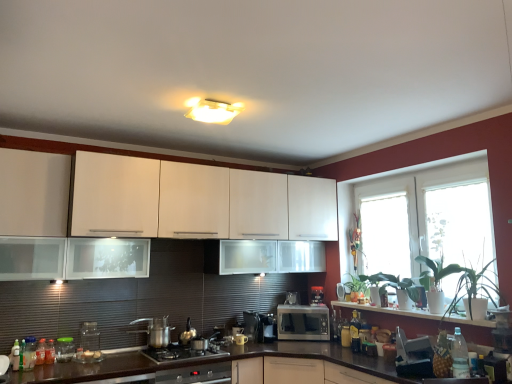
Question: Is golden glass bottle at center-right, which is the 3th bottle in left-to-right order, looking in the opposite direction of white glossy window at lower right?

Choices:
 (A) yes
 (B) no

Answer: (B)

Question: From a real-world perspective, is golden glass bottle at center-right, the second bottle when ordered from front to back, on white glossy window at lower right?

Choices:
 (A) no
 (B) yes

Answer: (A)

Question: Considering the relative sizes of golden glass bottle at center-right, which is the 1th bottle from right to left, and white glossy window at lower right in the image provided, is golden glass bottle at center-right, which is the 1th bottle from right to left, taller than white glossy window at lower right?

Choices:
 (A) no
 (B) yes

Answer: (A)

Question: Considering the relative sizes of golden glass bottle at center-right, the 2th bottle in the back-to-front sequence, and white glossy window at lower right in the image provided, is golden glass bottle at center-right, the 2th bottle in the back-to-front sequence, wider than white glossy window at lower right?

Choices:
 (A) yes
 (B) no

Answer: (B)

Question: Could white glossy window at lower right be considered to be inside golden glass bottle at center-right, the second bottle when ordered from front to back?

Choices:
 (A) yes
 (B) no

Answer: (B)

Question: Visually, is green glossy plant at right, the 2th plant when ordered from back to front, positioned to the left or to the right of transparent glass window at right, the first window screen from the front?

Choices:
 (A) left
 (B) right

Answer: (A)

Question: In the image, is green glossy plant at right, the 2th plant when ordered from back to front, positioned in front of or behind transparent glass window at right, the first window screen from the front?

Choices:
 (A) front
 (B) behind

Answer: (A)

Question: Is green glossy plant at right, the 2th plant when ordered from back to front, taller or shorter than transparent glass window at right, which appears as the second window screen when viewed from the left?

Choices:
 (A) short
 (B) tall

Answer: (A)

Question: Is green glossy plant at right, the 2th plant when ordered from back to front, wider or thinner than transparent glass window at right, which ranks as the first window screen in right-to-left order?

Choices:
 (A) thin
 (B) wide

Answer: (B)

Question: From their relative heights in the image, would you say transparent glass jar at lower left, which appears as the 5th appliance when viewed from the back, is taller or shorter than green leafy plant at right, the first plant when ordered from back to front?

Choices:
 (A) tall
 (B) short

Answer: (B)

Question: Relative to green leafy plant at right, arranged as the third plant when viewed from the front, is transparent glass jar at lower left, which appears as the 5th appliance when viewed from the back, in front or behind?

Choices:
 (A) behind
 (B) front

Answer: (B)

Question: Is point (61, 344) closer or farther from the camera than point (348, 284)?

Choices:
 (A) farther
 (B) closer

Answer: (B)

Question: From a real-world perspective, is transparent glass jar at lower left, which is the 2th appliance in front-to-back order, physically located above or below green leafy plant at right, arranged as the third plant when viewed from the front?

Choices:
 (A) below
 (B) above

Answer: (A)

Question: Relative to translucent plastic bottle at lower right, which appears as the 1th bottle when viewed from the back, is metallic silver kettle at center, which ranks as the fourth appliance in front-to-back order, in front or behind?

Choices:
 (A) behind
 (B) front

Answer: (B)

Question: Would you say metallic silver kettle at center, marked as the fourth appliance in a right-to-left arrangement, is to the left or to the right of translucent plastic bottle at lower right, positioned as the second bottle in left-to-right order, in the picture?

Choices:
 (A) left
 (B) right

Answer: (A)